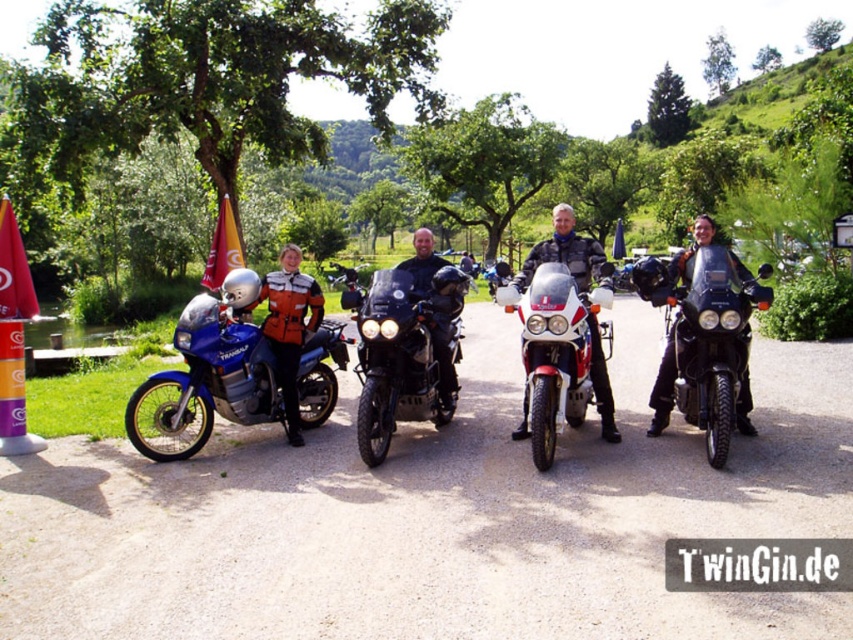
You are standing at the origin point of the coordinate system where the bottom left corner of the image is the origin. The shiny black motorcycle at center is at point (398, 356). If you want to walk directly towards the shiny black motorcycle at center, in which direction should you move?

To move towards the shiny black motorcycle at center located at point (398, 356) from the origin at the bottom left corner, you should move northeast. This is because the x and y coordinates are both greater than 0.5, indicating the motorcycle is in the upper right quadrant of the image.

You are planning to park your car in this area and need to know the space between the shiny black motorcycle at center and the shiny black motorcycle at right. Can you determine if there is enough space for your car to fit between them?

The shiny black motorcycle at center is larger in size than the shiny black motorcycle at right, but the exact distance between them is not provided. Without knowing the specific dimensions of the space between them, it is impossible to determine if your car can fit.